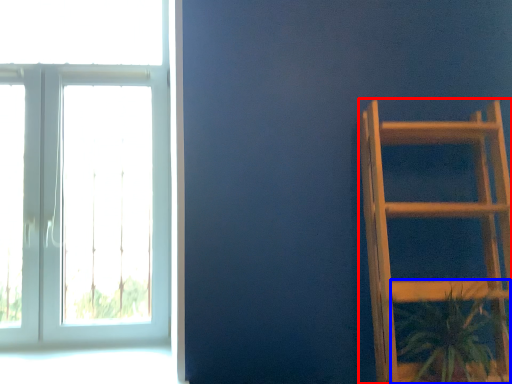
Question: Which of the following is the farthest to the observer, furniture (highlighted by a red box) or houseplant (highlighted by a blue box)?

Choices:
 (A) furniture
 (B) houseplant

Answer: (B)